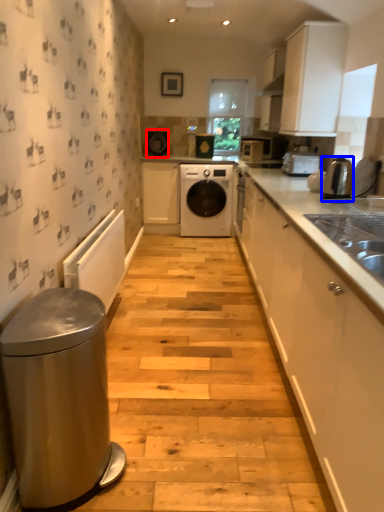
Question: Which of the following is the closest to the observer, appliance (highlighted by a red box) or home appliance (highlighted by a blue box)?

Choices:
 (A) appliance
 (B) home appliance

Answer: (B)